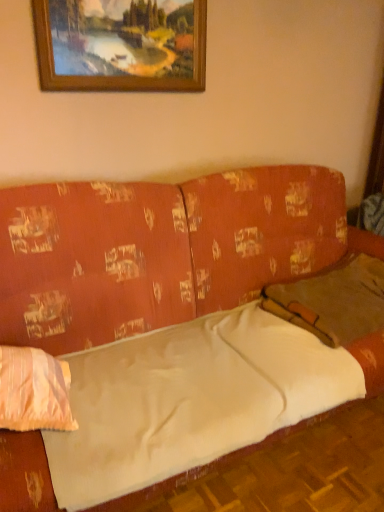
Question: Considering the positions of point (362, 270) and point (39, 379), is point (362, 270) closer or farther from the camera than point (39, 379)?

Choices:
 (A) closer
 (B) farther

Answer: (B)

Question: Visually, is brown fabric pillow at right, acting as the first pillow starting from the right, positioned to the left or to the right of light pink fabric pillow at left, placed as the 1th pillow when sorted from front to back?

Choices:
 (A) left
 (B) right

Answer: (B)

Question: Which of these objects is positioned closest to the textured orange couch at center?

Choices:
 (A) wooden picture frame at upper center
 (B) light pink fabric pillow at left, placed as the 1th pillow when sorted from front to back
 (C) brown fabric pillow at right, arranged as the 2th pillow when viewed from the front

Answer: (C)

Question: Which object is the farthest from the textured orange couch at center?

Choices:
 (A) brown fabric pillow at right, acting as the first pillow starting from the right
 (B) wooden picture frame at upper center
 (C) light pink fabric pillow at left, positioned as the 2th pillow in right-to-left order

Answer: (C)